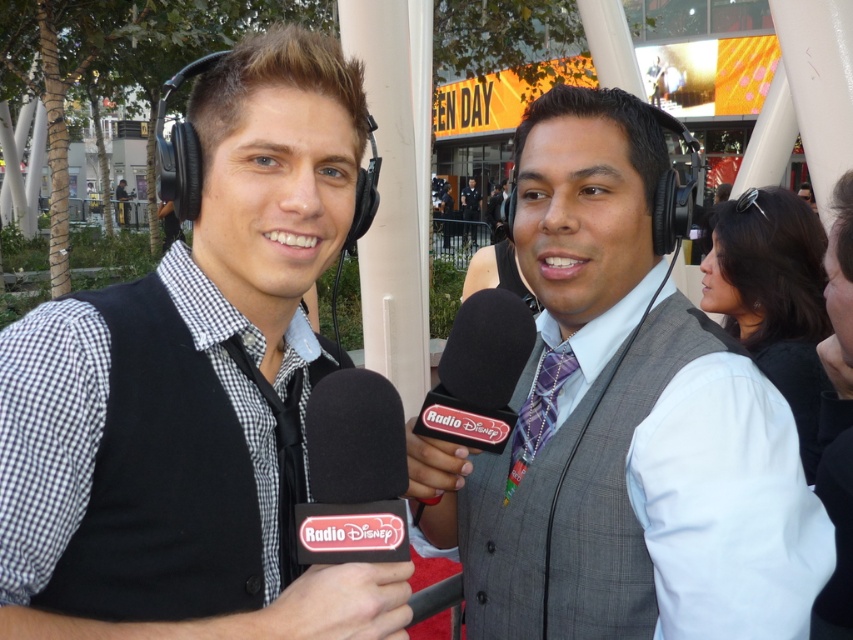
In the scene shown: You are a guest at the event and want to choose a microphone to interview a celebrity. Which microphone is positioned to the left side between the black foam microphone at center and the black plastic microphone at center?

The black foam microphone at center is positioned to the left of the black plastic microphone at center, so you should choose the black foam microphone at center.

You are organizing a costume party and need to decide which item will take up more space when laid flat on a table. Based on the image, which item is wider between the gray plaid vest at center and the purple plaid tie at center?

The gray plaid vest at center might be wider than the purple plaid tie at center, so the gray plaid vest at center would likely take up more space when laid flat on a table.

You are a fashion designer analyzing the outfits in the image. Which item of clothing, the gray plaid vest at center or the purple plaid tie at center, would you say occupies more visual space in the composition?

The gray plaid vest at center has a larger size compared to the purple plaid tie at center, so it occupies more visual space in the composition.